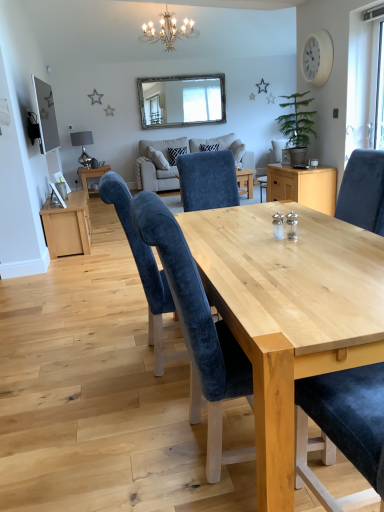
The width and height of the screenshot is (384, 512). Identify the location of vacant area that is in front of velvet blue chair at center, arranged as the first chair when viewed from the back. click(x=135, y=411).